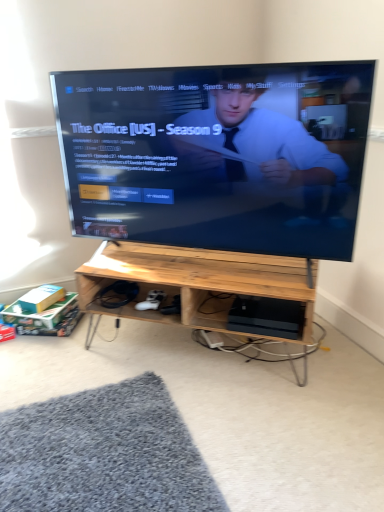
Question: Is black glossy tv at center outside of natural wood desk at center?

Choices:
 (A) no
 (B) yes

Answer: (B)

Question: Is black glossy tv at center to the right of natural wood desk at center from the viewer's perspective?

Choices:
 (A) no
 (B) yes

Answer: (A)

Question: Is black glossy tv at center thinner than natural wood desk at center?

Choices:
 (A) no
 (B) yes

Answer: (B)

Question: Does black glossy tv at center have a smaller size compared to natural wood desk at center?

Choices:
 (A) no
 (B) yes

Answer: (A)

Question: Is black glossy tv at center turned away from natural wood desk at center?

Choices:
 (A) no
 (B) yes

Answer: (A)

Question: From a real-world perspective, is natural wood desk at center positioned above or below black plastic computer at lower center?

Choices:
 (A) above
 (B) below

Answer: (B)

Question: Considering their positions, is natural wood desk at center located in front of or behind black plastic computer at lower center?

Choices:
 (A) behind
 (B) front

Answer: (B)

Question: From the image's perspective, relative to black plastic computer at lower center, is natural wood desk at center above or below?

Choices:
 (A) above
 (B) below

Answer: (A)

Question: Is point (193, 327) closer or farther from the camera than point (292, 333)?

Choices:
 (A) closer
 (B) farther

Answer: (B)

Question: From the image's perspective, is black plastic computer at lower center positioned above or below natural wood desk at center?

Choices:
 (A) below
 (B) above

Answer: (A)

Question: Is point (297, 309) closer or farther from the camera than point (231, 266)?

Choices:
 (A) closer
 (B) farther

Answer: (A)

Question: Considering their positions, is black plastic computer at lower center located in front of or behind natural wood desk at center?

Choices:
 (A) front
 (B) behind

Answer: (B)

Question: Looking at the image, does black plastic computer at lower center seem bigger or smaller compared to natural wood desk at center?

Choices:
 (A) big
 (B) small

Answer: (B)

Question: From a real-world perspective, is black glossy tv at center positioned above or below natural wood desk at center?

Choices:
 (A) below
 (B) above

Answer: (B)

Question: Considering the positions of black glossy tv at center and natural wood desk at center in the image, is black glossy tv at center bigger or smaller than natural wood desk at center?

Choices:
 (A) small
 (B) big

Answer: (B)